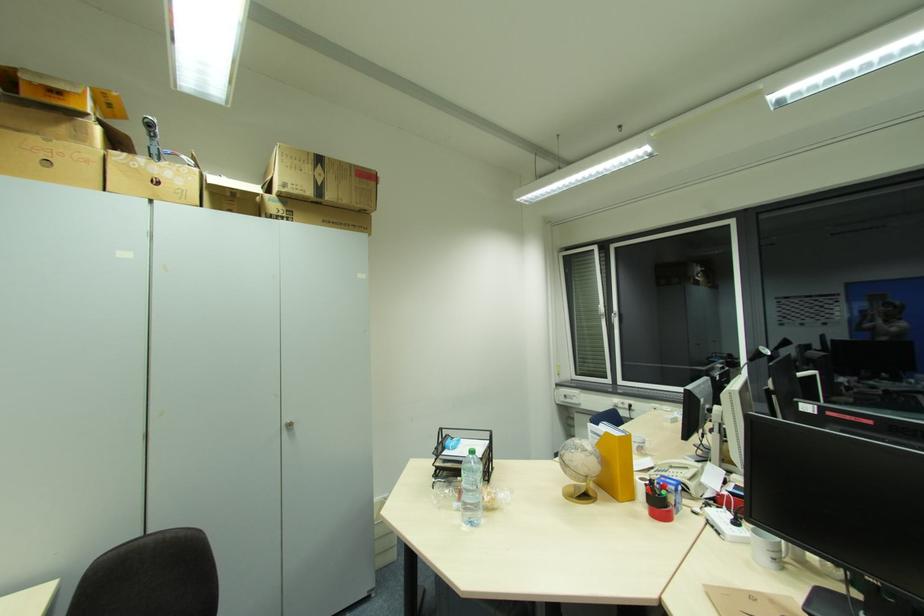
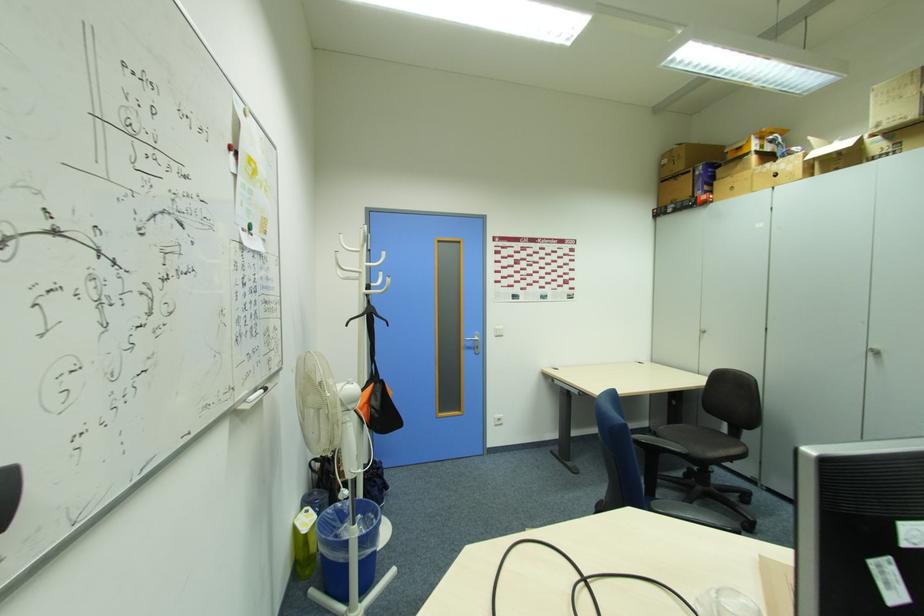
The point at (293, 427) is marked in the first image. Where is the corresponding point in the second image?

(880, 354)